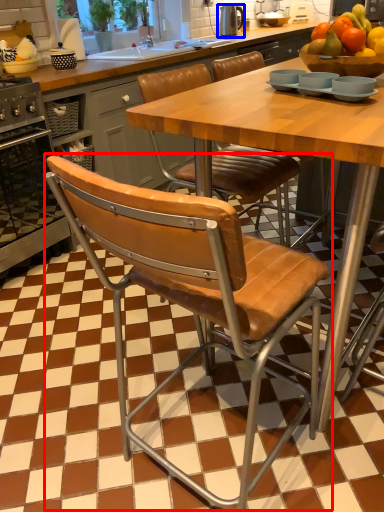
Question: Which point is further to the camera, chair (highlighted by a red box) or appliance (highlighted by a blue box)?

Choices:
 (A) chair
 (B) appliance

Answer: (B)